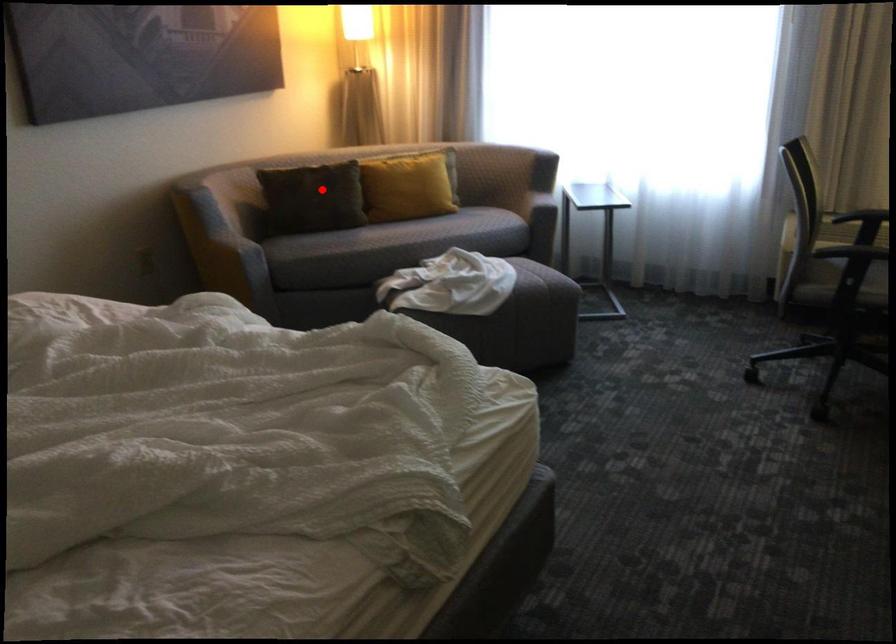
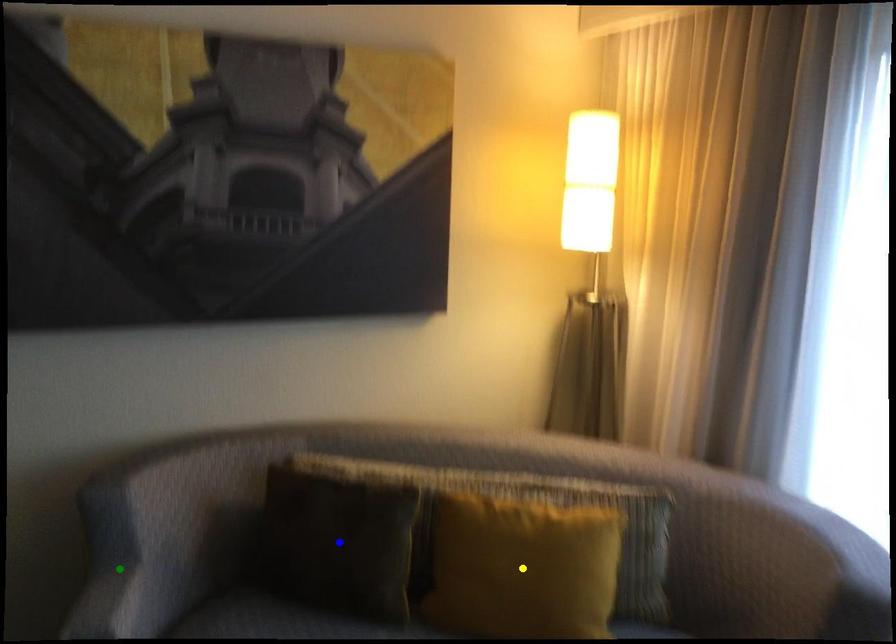
Question: I am providing you with two images of the same scene from different viewpoints. A red point is marked on the first image. You are given multiple points on the second image. Which spot in image 2 lines up with the point in image 1?

Choices:
 (A) yellow point
 (B) blue point
 (C) green point

Answer: (B)